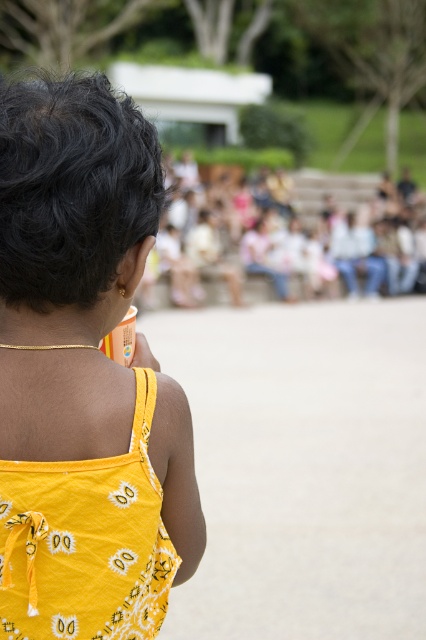
You are a photographer trying to capture the girl in the scene. Which clothing item, the yellow printed tank top at center or the yellow printed fabric dress at center, would appear closer to you in the photo?

The yellow printed tank top at center would appear closer to you in the photo because it is further to the viewer than the yellow printed fabric dress at center.

Based on the scene description, which clothing item is positioned higher on the young girl? The yellow printed tank top at center or the yellow printed fabric dress at center?

The yellow printed tank top at center is much taller than the yellow printed fabric dress at center, so the tank top is positioned higher on the young girl.

You are a photographer at the event and want to capture both the yellow printed tank top at center and the yellow printed fabric dress at center in the same frame. Which clothing item should you focus on first to ensure both are in the frame?

The yellow printed tank top at center is positioned on the left side of yellow printed fabric dress at center, so you should focus on the yellow printed tank top at center first to ensure both are in the frame.